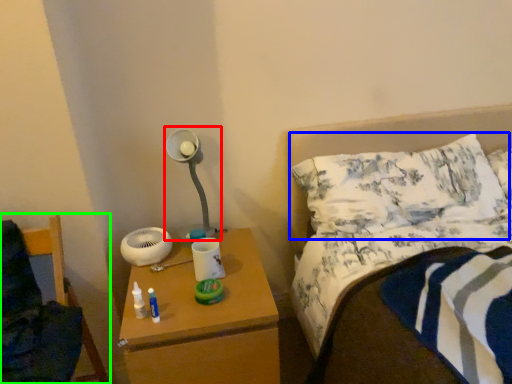
Question: Which is nearer to the lamp (highlighted by a red box)? pillow (highlighted by a blue box) or furniture (highlighted by a green box).

Choices:
 (A) pillow
 (B) furniture

Answer: (B)